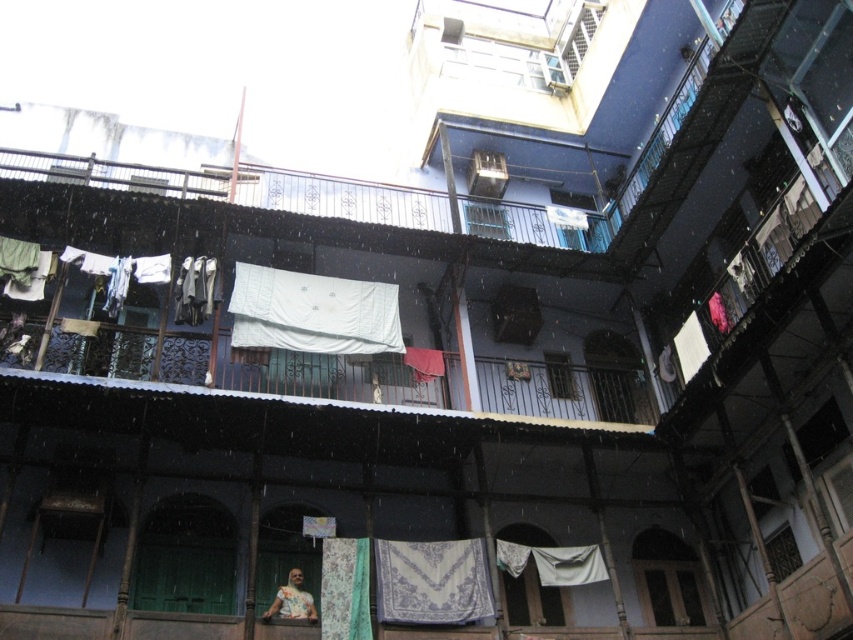
Question: Does white fabric at center lie behind blue textured fabric at center?

Choices:
 (A) no
 (B) yes

Answer: (B)

Question: In this image, where is white fabric at center located relative to blue textured fabric at center?

Choices:
 (A) left
 (B) right

Answer: (A)

Question: Considering the real-world distances, which object is closest to the blue textured fabric at center?

Choices:
 (A) printed fabric woman at lower center
 (B) white fabric at center

Answer: (A)

Question: Which object is farther from the camera taking this photo?

Choices:
 (A) white fabric at center
 (B) printed fabric woman at lower center
 (C) blue textured fabric at center

Answer: (A)

Question: Is blue textured fabric at center closer to the viewer compared to printed fabric woman at lower center?

Choices:
 (A) yes
 (B) no

Answer: (B)

Question: Which of the following is the closest to the observer?

Choices:
 (A) (437, 586)
 (B) (299, 598)
 (C) (334, 296)

Answer: (B)